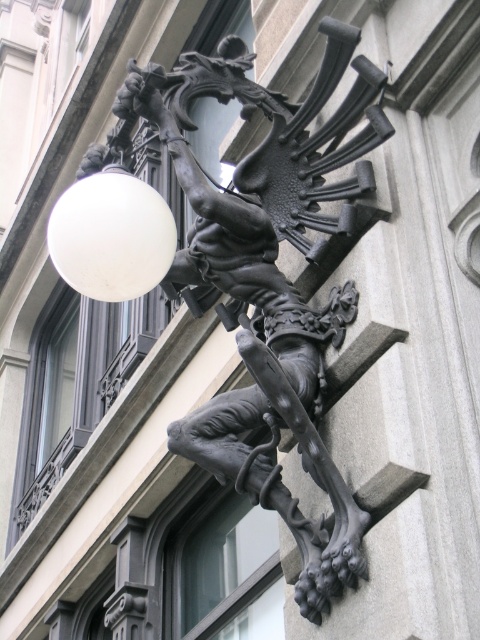
You are an art installer who needs to ensure the white matte sphere at upper left and the black matte sculpture at upper center are visible from the main entrance. Given their sizes, which object might be more easily seen from a distance?

The black matte sculpture at upper center has a larger size compared to the white matte sphere at upper left, so it would be more easily seen from a distance.

You are an art conservator examining the metal sculpture. You notice two points on the sculpture labeled as point (85, 252) and point (164, 240). Which of these points is nearer to your viewpoint as you stand in front of the sculpture?

Point (85, 252) is closer to the camera than point (164, 240). Therefore, point (85, 252) is nearer to your viewpoint.